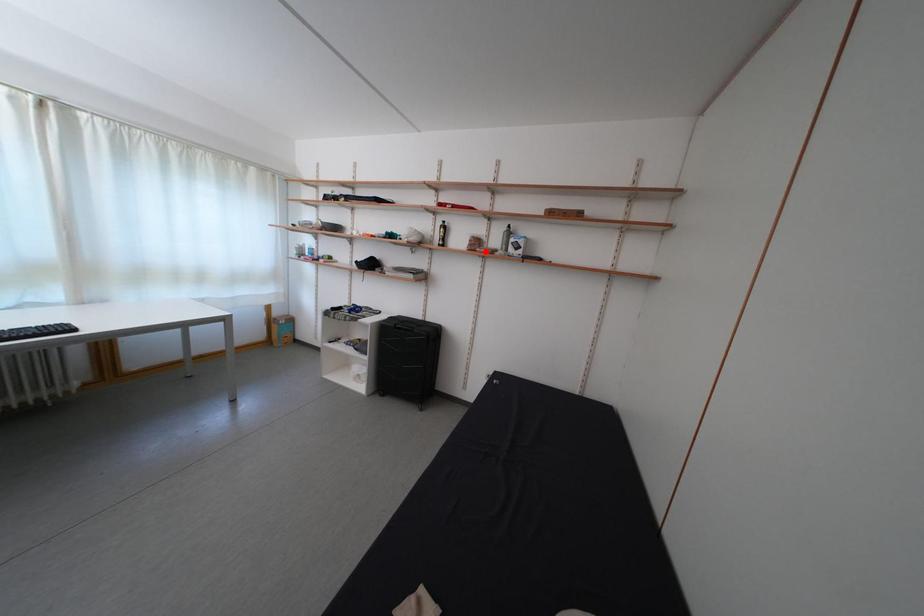
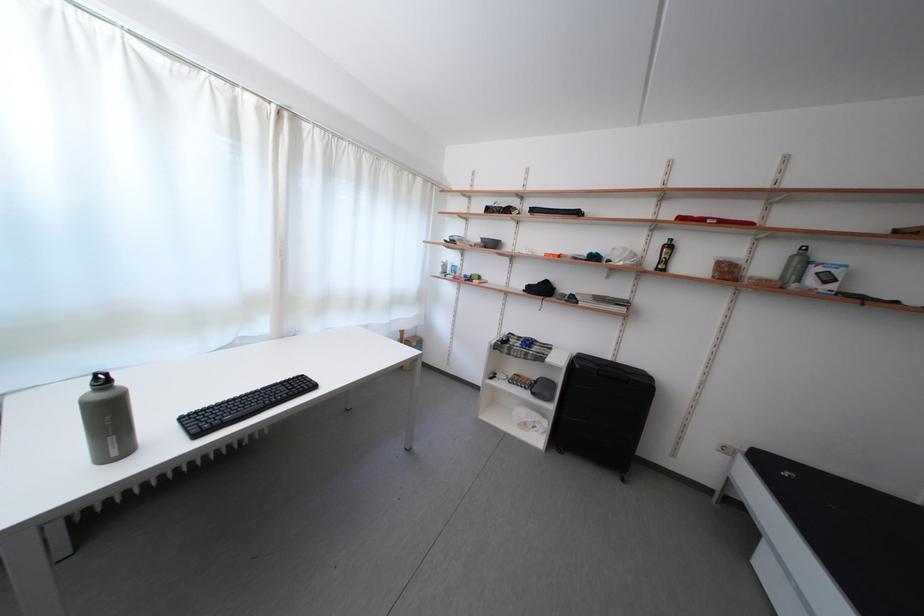
Locate, in the second image, the point that corresponds to the highlighted location in the first image.

(736, 278)